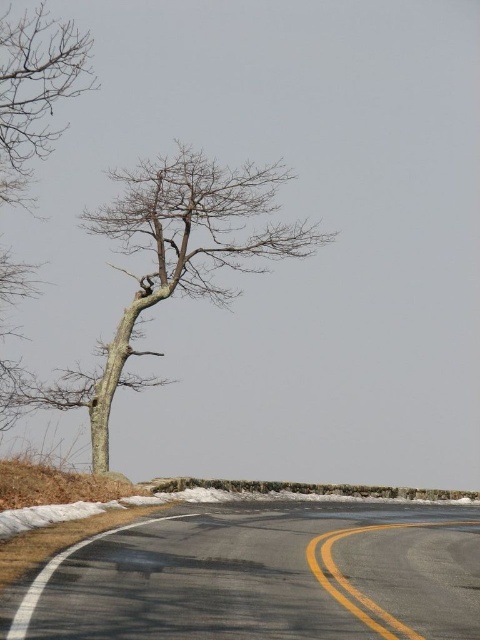
Question: Which is nearer to the yellow asphalt at lower center?

Choices:
 (A) black asphalt road at lower center
 (B) bark textured tree at center

Answer: (A)

Question: Considering the relative positions of bark textured tree at center and yellow asphalt at lower center in the image provided, where is bark textured tree at center located with respect to yellow asphalt at lower center?

Choices:
 (A) above
 (B) below

Answer: (A)

Question: Among these points, which one is nearest to the camera?

Choices:
 (A) pos(135,209)
 (B) pos(276,529)
 (C) pos(373,529)

Answer: (B)

Question: Which of these objects is positioned farthest from the black asphalt road at lower center?

Choices:
 (A) bare branches at upper left
 (B) bark textured tree at center
 (C) yellow asphalt at lower center

Answer: (B)

Question: Is bark textured tree at center to the left of bare branches at upper left from the viewer's perspective?

Choices:
 (A) yes
 (B) no

Answer: (B)

Question: Is black asphalt road at lower center bigger than yellow asphalt at lower center?

Choices:
 (A) no
 (B) yes

Answer: (B)